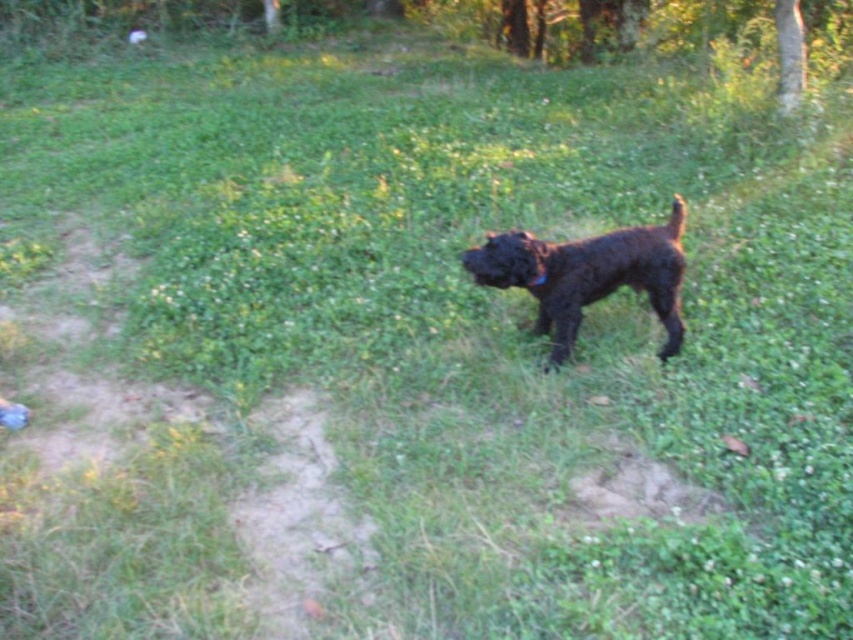
Question: Among these points, which one is nearest to the camera?

Choices:
 (A) (538, 266)
 (B) (642, 248)

Answer: (A)

Question: Can you confirm if shiny black dog at center is positioned to the left of black fabric neckband at center?

Choices:
 (A) no
 (B) yes

Answer: (A)

Question: Can you confirm if shiny black dog at center is thinner than black fabric neckband at center?

Choices:
 (A) no
 (B) yes

Answer: (A)

Question: Does shiny black dog at center appear on the left side of black fabric neckband at center?

Choices:
 (A) no
 (B) yes

Answer: (A)